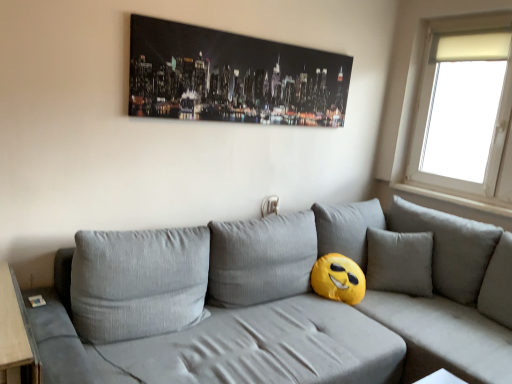
Question: Is white frosted glass window at upper right facing away from black glossy canvas at upper center?

Choices:
 (A) yes
 (B) no

Answer: (B)

Question: From a real-world perspective, does white frosted glass window at upper right sit lower than black glossy canvas at upper center?

Choices:
 (A) no
 (B) yes

Answer: (B)

Question: Does white frosted glass window at upper right have a larger size compared to black glossy canvas at upper center?

Choices:
 (A) yes
 (B) no

Answer: (A)

Question: Does white frosted glass window at upper right appear on the right side of black glossy canvas at upper center?

Choices:
 (A) no
 (B) yes

Answer: (B)

Question: Is white frosted glass window at upper right aimed at black glossy canvas at upper center?

Choices:
 (A) no
 (B) yes

Answer: (B)

Question: Considering the positions of point (472, 183) and point (208, 296), is point (472, 183) closer or farther from the camera than point (208, 296)?

Choices:
 (A) closer
 (B) farther

Answer: (B)

Question: In the image, is white frosted glass window at upper right on the left side or the right side of textured gray couch at center?

Choices:
 (A) right
 (B) left

Answer: (A)

Question: Is white frosted glass window at upper right bigger or smaller than textured gray couch at center?

Choices:
 (A) big
 (B) small

Answer: (B)

Question: Is white frosted glass window at upper right in front of or behind textured gray couch at center in the image?

Choices:
 (A) front
 (B) behind

Answer: (B)

Question: Is point (426, 97) closer or farther from the camera than point (297, 49)?

Choices:
 (A) closer
 (B) farther

Answer: (B)

Question: Is white frosted glass window at upper right wider or thinner than black glossy canvas at upper center?

Choices:
 (A) thin
 (B) wide

Answer: (B)

Question: Would you say white frosted glass window at upper right is to the left or to the right of black glossy canvas at upper center in the picture?

Choices:
 (A) right
 (B) left

Answer: (A)

Question: Is white frosted glass window at upper right taller or shorter than black glossy canvas at upper center?

Choices:
 (A) tall
 (B) short

Answer: (A)

Question: Is black glossy canvas at upper center bigger or smaller than white frosted glass window at upper right?

Choices:
 (A) small
 (B) big

Answer: (A)

Question: Is black glossy canvas at upper center to the left or to the right of white frosted glass window at upper right in the image?

Choices:
 (A) right
 (B) left

Answer: (B)